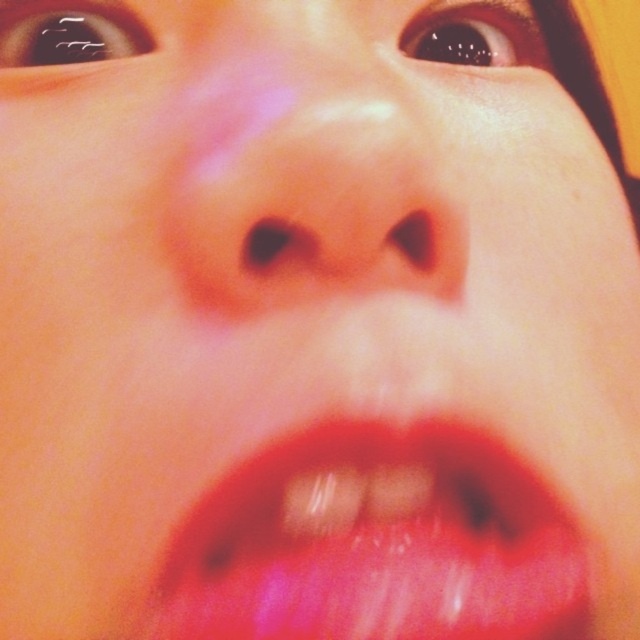
Who is lower down, shiny red lips at lower center or smooth skin nose at center?

Positioned lower is shiny red lips at lower center.

Can you confirm if shiny red lips at lower center is positioned below smooth skin nose at center?

Yes.

Does point (493, 540) come farther from viewer compared to point (225, 124)?

Yes.

At what (x,y) coordinates should I click in order to perform the action: click on shiny red lips at lower center. Please return your answer as a coordinate pair (x, y). Looking at the image, I should click on (376, 544).